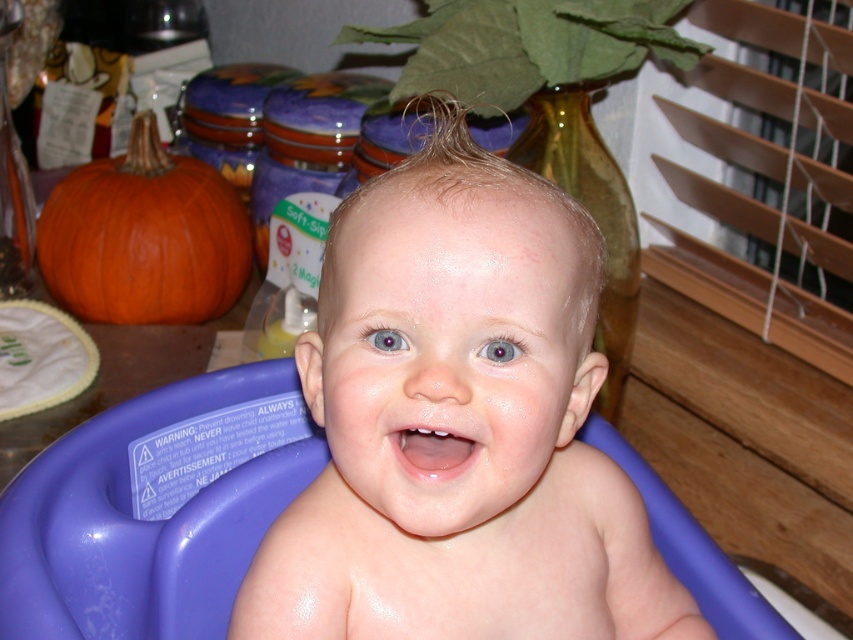
Question: Can you confirm if purple plastic bath at center is bigger than orange matte pumpkin at left?

Choices:
 (A) no
 (B) yes

Answer: (A)

Question: Which object is the farthest from the smooth skin baby at center?

Choices:
 (A) orange matte pumpkin at left
 (B) purple plastic bath at center

Answer: (A)

Question: Does smooth skin baby at center appear over purple plastic bath at center?

Choices:
 (A) yes
 (B) no

Answer: (A)

Question: Which of the following is the farthest from the observer?

Choices:
 (A) orange matte pumpkin at left
 (B) purple plastic bath at center
 (C) smooth skin baby at center

Answer: (A)

Question: Among these objects, which one is nearest to the camera?

Choices:
 (A) smooth skin baby at center
 (B) orange matte pumpkin at left
 (C) purple plastic bath at center

Answer: (A)

Question: Is smooth skin baby at center thinner than purple plastic bath at center?

Choices:
 (A) no
 (B) yes

Answer: (A)